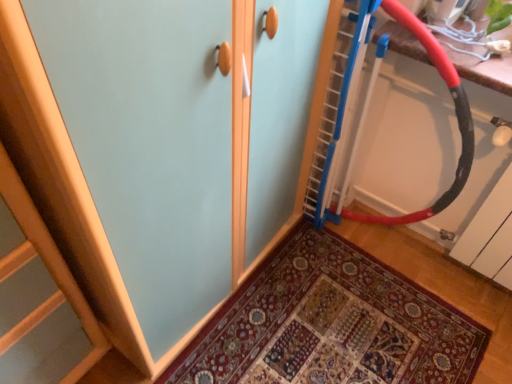
Question: Looking at the image, does wooden door at center seem bigger or smaller compared to red rubber battle rope at upper right?

Choices:
 (A) small
 (B) big

Answer: (A)

Question: From the image's perspective, is wooden door at center above or below red rubber battle rope at upper right?

Choices:
 (A) above
 (B) below

Answer: (B)

Question: Is wooden door at center taller or shorter than red rubber battle rope at upper right?

Choices:
 (A) short
 (B) tall

Answer: (A)

Question: Considering the positions of red rubber battle rope at upper right and wooden door at center in the image, is red rubber battle rope at upper right bigger or smaller than wooden door at center?

Choices:
 (A) big
 (B) small

Answer: (A)

Question: From the image's perspective, is red rubber battle rope at upper right located above or below wooden door at center?

Choices:
 (A) above
 (B) below

Answer: (A)

Question: Considering the positions of red rubber battle rope at upper right and wooden door at center in the image, is red rubber battle rope at upper right wider or thinner than wooden door at center?

Choices:
 (A) wide
 (B) thin

Answer: (B)

Question: In terms of height, does red rubber battle rope at upper right look taller or shorter compared to wooden door at center?

Choices:
 (A) tall
 (B) short

Answer: (A)